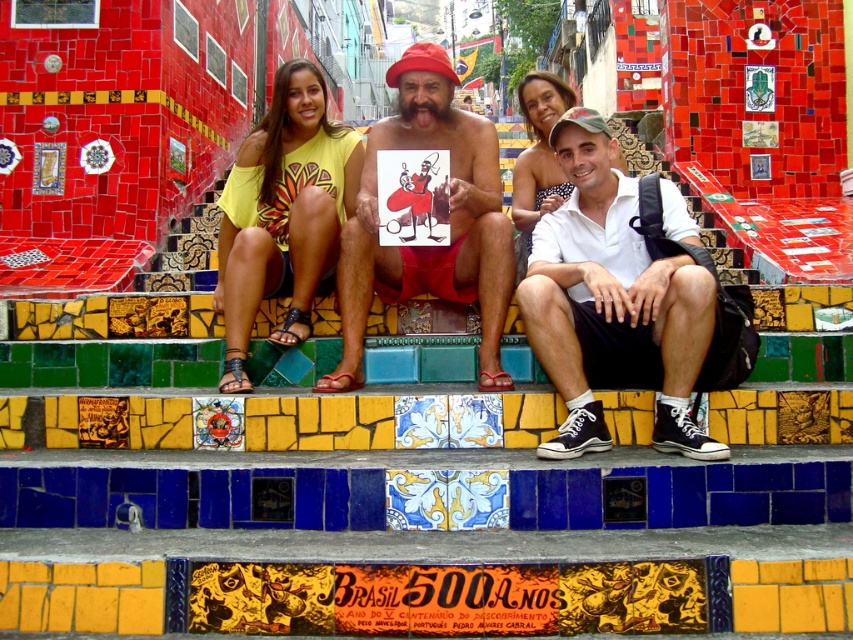
You are standing in front of the tiled steps and want to hand a leaflet to the person wearing the white cotton shirt at center and the matte red shorts at center. Which one should you approach first based on their position?

The white cotton shirt at center is closer to the viewer than the matte red shorts at center, so you should approach the person wearing the white cotton shirt at center first.

You are an artist trying to sketch the scene. You notice the white cotton shirt at center and the yellow cotton shirt at center. Which shirt should you draw first if you want to capture the one that is wider first?

The white cotton shirt at center might be wider than yellow cotton shirt at center, so you should draw the white cotton shirt at center first to capture the wider one first.